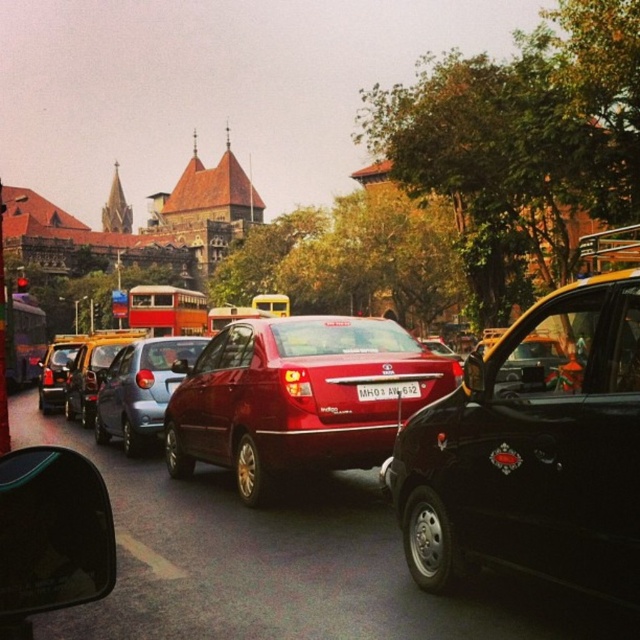
Can you confirm if shiny red sedan at center is positioned above metallic silver taxi at center?

Incorrect, shiny red sedan at center is not positioned above metallic silver taxi at center.

Who is positioned more to the right, shiny red sedan at center or metallic silver taxi at center?

From the viewer's perspective, shiny red sedan at center appears more on the right side.

Who is more forward, (x=442, y=362) or (x=80, y=358)?

Point (x=442, y=362)

This screenshot has width=640, height=640. I want to click on shiny red sedan at center, so click(x=296, y=397).

Can you confirm if satin red sedan at center is positioned to the left of white plastic license plate at center?

Indeed, satin red sedan at center is positioned on the left side of white plastic license plate at center.

Which is in front, point (148, 397) or point (380, 396)?

Point (380, 396) is more forward.

At what (x,y) coordinates should I click in order to perform the action: click on satin red sedan at center. Please return your answer as a coordinate pair (x, y). This screenshot has height=640, width=640. Looking at the image, I should click on (140, 388).

Who is shorter, metallic silver taxi at center or matte black car at left?

matte black car at left is shorter.

Does metallic silver taxi at center have a lesser height compared to matte black car at left?

No.

This screenshot has width=640, height=640. What do you see at coordinates (92, 372) in the screenshot? I see `metallic silver taxi at center` at bounding box center [92, 372].

What are the coordinates of `metallic silver taxi at center` in the screenshot? It's located at (92, 372).